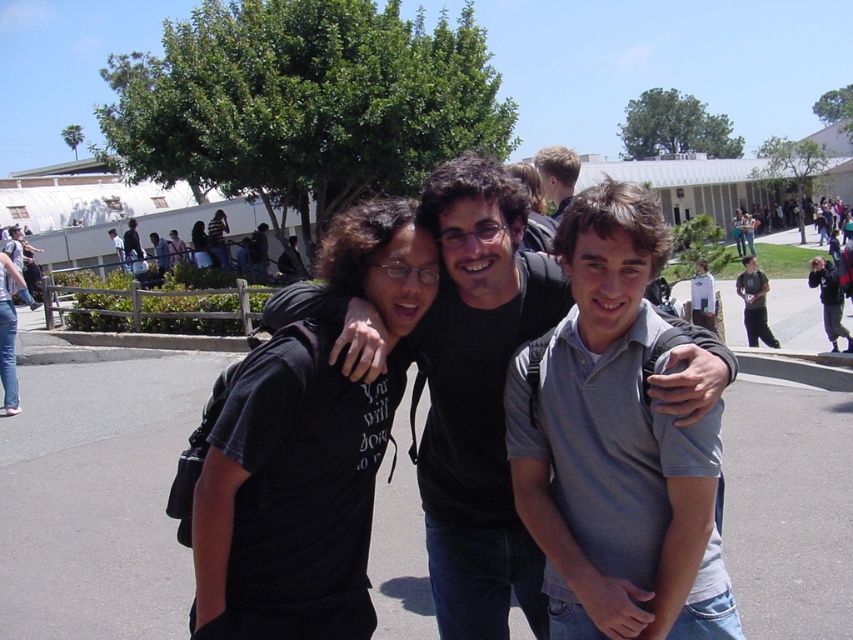
Question: From the image, what is the correct spatial relationship of black matte t-shirt at center in relation to light brown hair at upper center?

Choices:
 (A) right
 (B) left

Answer: (B)

Question: Is black matte t-shirt at center further to camera compared to black matte shirt at center?

Choices:
 (A) yes
 (B) no

Answer: (B)

Question: Which point is closer to the camera taking this photo?

Choices:
 (A) (741, 260)
 (B) (622, 632)

Answer: (B)

Question: Among these objects, which one is farthest from the camera?

Choices:
 (A) gray cotton polo shirt at center
 (B) black matte t-shirt at center
 (C) dark gray shirt at center
 (D) black matte shirt at center

Answer: (C)

Question: Observing the image, what is the correct spatial positioning of black matte shirt at center in reference to light brown hair at upper center?

Choices:
 (A) above
 (B) below

Answer: (B)

Question: Which object is closer to the camera taking this photo?

Choices:
 (A) gray cotton polo shirt at center
 (B) black matte t-shirt at center
 (C) black matte shirt at center

Answer: (A)